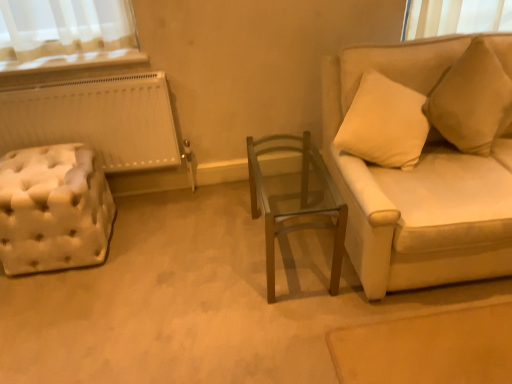
Question: From a real-world perspective, is white tufted ottoman at left positioned under wooden glass table at center based on gravity?

Choices:
 (A) yes
 (B) no

Answer: (A)

Question: From the image's perspective, is white tufted ottoman at left over wooden glass table at center?

Choices:
 (A) yes
 (B) no

Answer: (A)

Question: Does white tufted ottoman at left have a greater width compared to wooden glass table at center?

Choices:
 (A) no
 (B) yes

Answer: (A)

Question: Is white tufted ottoman at left to the right of wooden glass table at center from the viewer's perspective?

Choices:
 (A) no
 (B) yes

Answer: (A)

Question: Considering the relative sizes of white tufted ottoman at left and wooden glass table at center in the image provided, is white tufted ottoman at left thinner than wooden glass table at center?

Choices:
 (A) no
 (B) yes

Answer: (B)

Question: Is white tufted ottoman at left far away from wooden glass table at center?

Choices:
 (A) no
 (B) yes

Answer: (A)

Question: Are wooden glass table at center and white tufted ottoman at left making contact?

Choices:
 (A) no
 (B) yes

Answer: (A)

Question: Is wooden glass table at center taller than white tufted ottoman at left?

Choices:
 (A) no
 (B) yes

Answer: (B)

Question: Is wooden glass table at center positioned far away from white tufted ottoman at left?

Choices:
 (A) no
 (B) yes

Answer: (A)

Question: Can you confirm if wooden glass table at center is shorter than white tufted ottoman at left?

Choices:
 (A) no
 (B) yes

Answer: (A)

Question: Does wooden glass table at center turn towards white tufted ottoman at left?

Choices:
 (A) no
 (B) yes

Answer: (A)

Question: Is wooden glass table at center to the right of white tufted ottoman at left from the viewer's perspective?

Choices:
 (A) yes
 (B) no

Answer: (A)

Question: From the image's perspective, would you say wooden glass table at center is positioned over beige fabric couch at right?

Choices:
 (A) no
 (B) yes

Answer: (A)